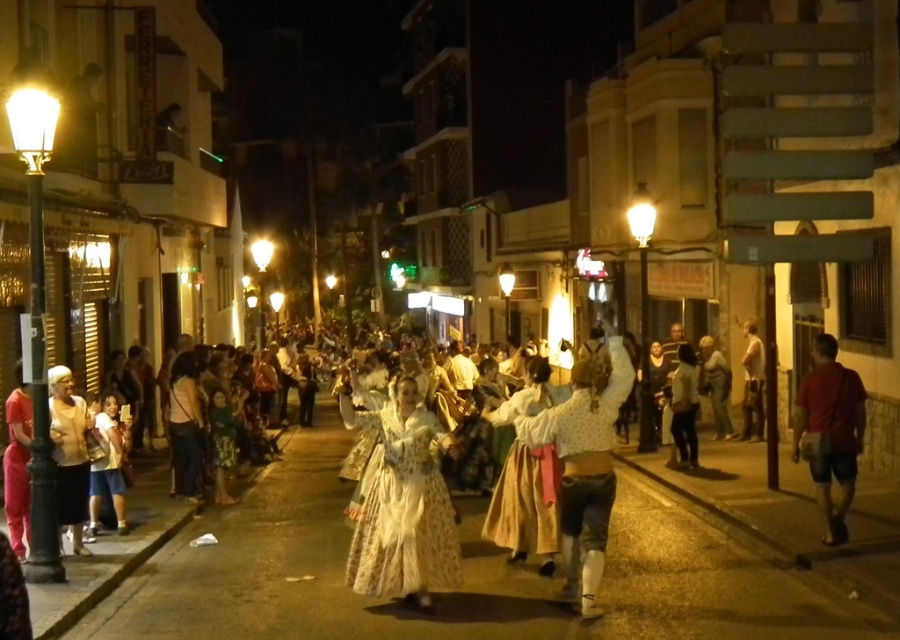
Question: Observing the image, what is the correct spatial positioning of red cotton shirt at right in reference to light beige fabric dress at lower left?

Choices:
 (A) left
 (B) right

Answer: (B)

Question: Is white lace blouse at center further to camera compared to light brown leather jacket at right?

Choices:
 (A) yes
 (B) no

Answer: (B)

Question: Which point is closer to the camera taking this photo?

Choices:
 (A) (51, 369)
 (B) (577, 544)

Answer: (B)

Question: Which object is closer to the camera taking this photo?

Choices:
 (A) white lace blouse at center
 (B) light beige fabric dress at lower left

Answer: (A)

Question: Which object appears farthest from the camera in this image?

Choices:
 (A) light brown leather jacket at right
 (B) white lace blouse at center
 (C) red cotton shirt at right

Answer: (A)

Question: Can you confirm if light beige fabric dress at lower left is smaller than light brown leather jacket at right?

Choices:
 (A) no
 (B) yes

Answer: (B)